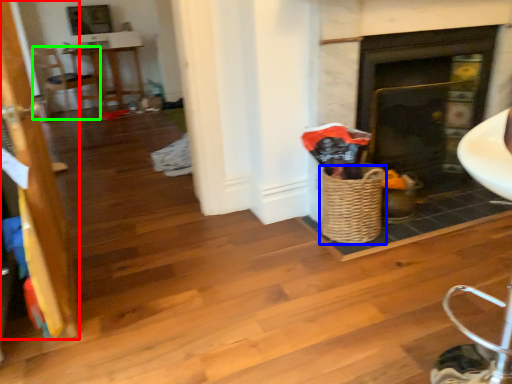
Question: Which object is the farthest from door (highlighted by a red box)? Choose among these: basket (highlighted by a blue box) or armchair (highlighted by a green box).

Choices:
 (A) basket
 (B) armchair

Answer: (B)